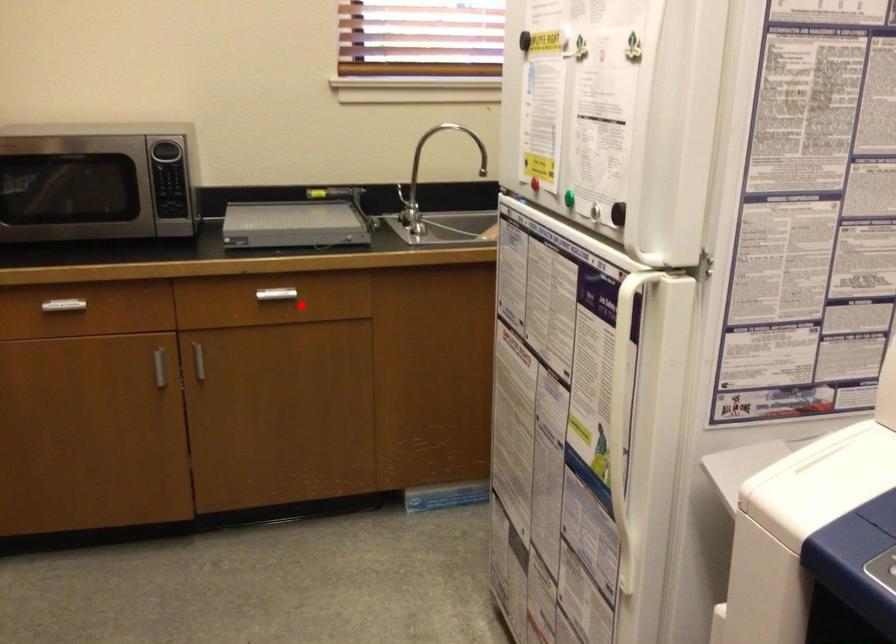
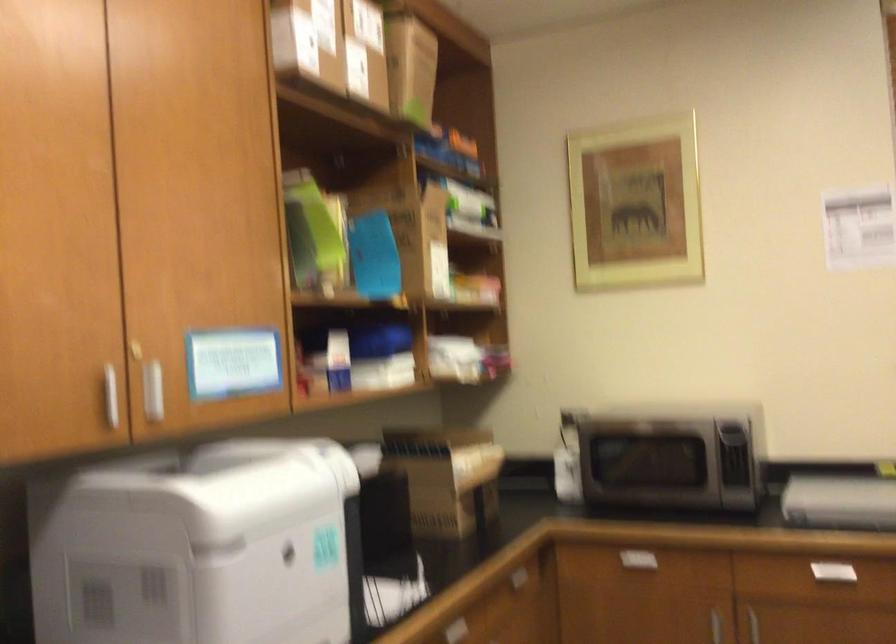
Find the pixel in the second image that matches the highlighted location in the first image.

(855, 579)